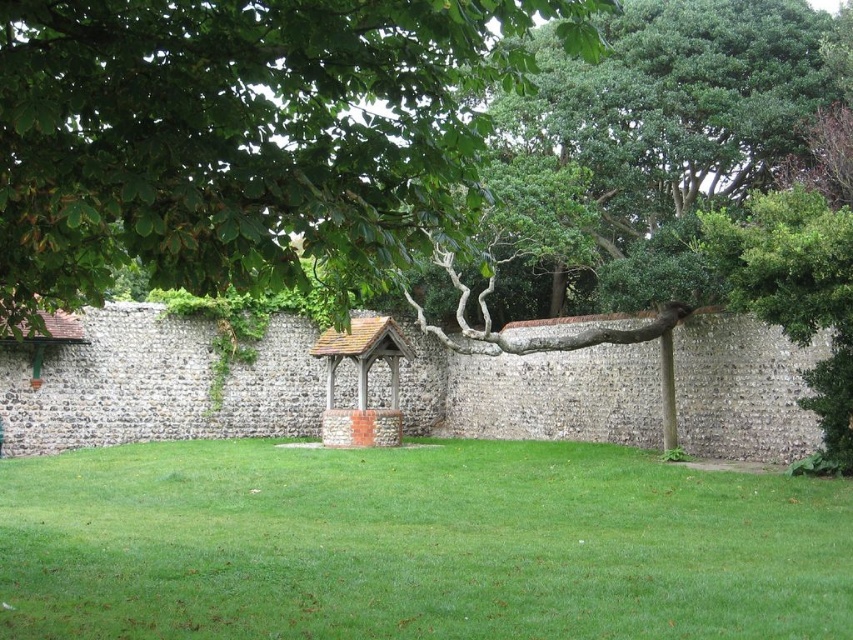
Question: Among these points, which one is nearest to the camera?

Choices:
 (A) (173, 52)
 (B) (160, 612)

Answer: (A)

Question: Which point is farther from the camera taking this photo?

Choices:
 (A) (700, 584)
 (B) (144, 195)

Answer: (A)

Question: Is green grass at center above green leafy tree at upper left?

Choices:
 (A) yes
 (B) no

Answer: (B)

Question: Is green grass at center below green leafy tree at upper left?

Choices:
 (A) yes
 (B) no

Answer: (A)

Question: Is green grass at center behind green leafy tree at upper left?

Choices:
 (A) no
 (B) yes

Answer: (B)